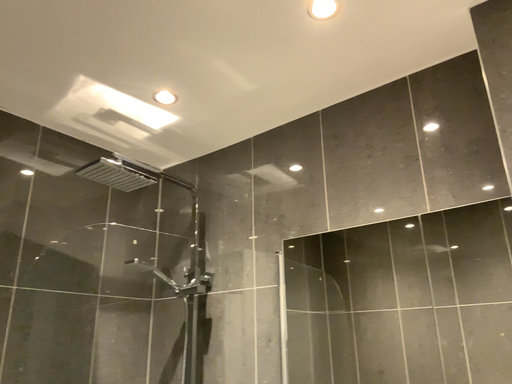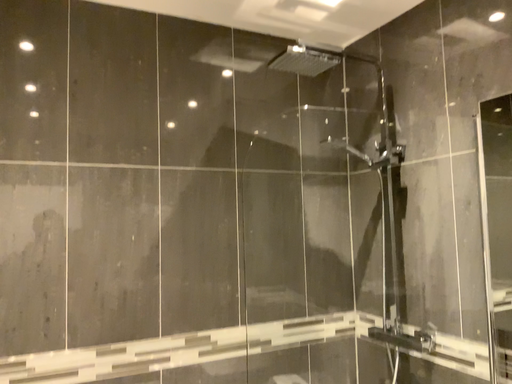
Question: How did the camera likely rotate when shooting the video?

Choices:
 (A) rotated downward
 (B) rotated upward

Answer: (A)